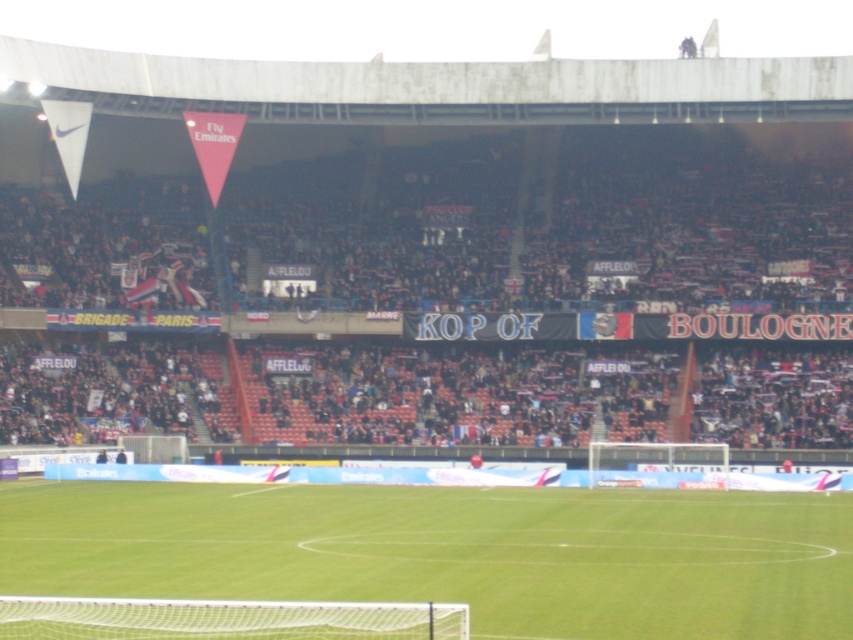
You are a stadium maintenance worker needing to move a 20 meters long equipment from the dark brown wooden bench at lower center to the green grass football field at center. Is there enough space to move it directly without rotating?

The dark brown wooden bench at lower center and green grass football field at center are 19.00 meters apart from each other. Since the equipment is 20 meters long, there isn not enough space to move it directly without rotating.

You are a photographer standing at the edge of the soccer field. You want to take a photo of the dark brown wooden bench at lower center and the green grass football field at center. Which object is closer to your current position?

The dark brown wooden bench at lower center is closer to your current position because it is located above the green grass football field at center, meaning it is nearer to the photographer standing at the edge of the field.